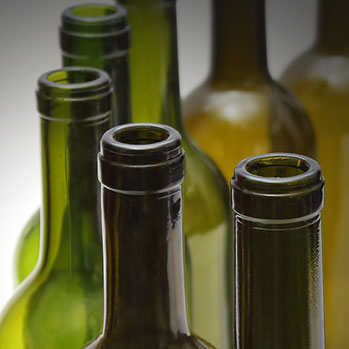
Image resolution: width=349 pixels, height=349 pixels. In order to click on bottle in this screenshot , I will do `click(219, 140)`.